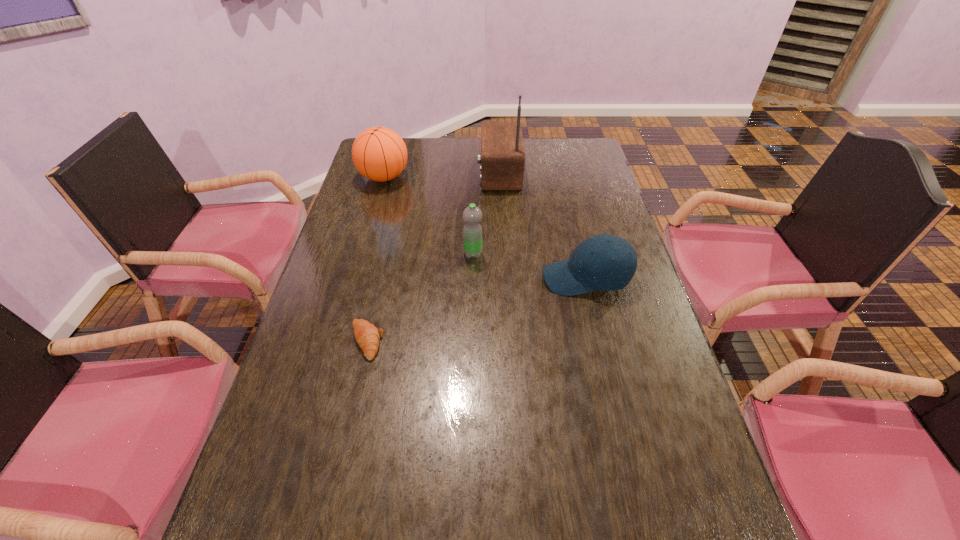
You are a GUI agent. You are given a task and a screenshot of the screen. Output one action in this format:
    pyautogui.click(x=<x>, y=<y>)
    Task: Click on the vacant area that lies between the tallest object and the nearest object
    The image size is (960, 540).
    Given the screenshot: What is the action you would take?
    pyautogui.click(x=433, y=257)

Find the location of a particular element. The width and height of the screenshot is (960, 540). vacant area between the fourth tallest object and the basketball is located at coordinates 485,228.

Find the location of a particular element. The width and height of the screenshot is (960, 540). vacant area that lies between the fourth farthest object and the water bottle is located at coordinates (530, 266).

At what (x,y) coordinates should I click in order to perform the action: click on unoccupied area between the water bottle and the shortest object. Please return your answer as a coordinate pair (x, y). Looking at the image, I should click on (420, 298).

Where is `vacant area between the second nearest object and the tallest object`? The height and width of the screenshot is (540, 960). vacant area between the second nearest object and the tallest object is located at coordinates (542, 226).

Locate an element on the screen. free space between the basketball and the second nearest object is located at coordinates (485, 228).

The height and width of the screenshot is (540, 960). In order to click on free space between the shortest object and the basketball in this screenshot , I will do `click(375, 259)`.

Where is `the second closest object to the radio receiver`? The height and width of the screenshot is (540, 960). the second closest object to the radio receiver is located at coordinates (472, 232).

Locate which object is the third closest to the shortest object. Please provide its 2D coordinates. Your answer should be formatted as a tuple, i.e. [(x, y)], where the tuple contains the x and y coordinates of a point satisfying the conditions above.

[(379, 154)]

At what (x,y) coordinates should I click in order to perform the action: click on vacant point that satisfies the following two spatial constraints: 1. on the front-facing side of the tallest object; 2. on the front side of the crescent roll. Please return your answer as a coordinate pair (x, y). The image size is (960, 540). Looking at the image, I should click on (508, 341).